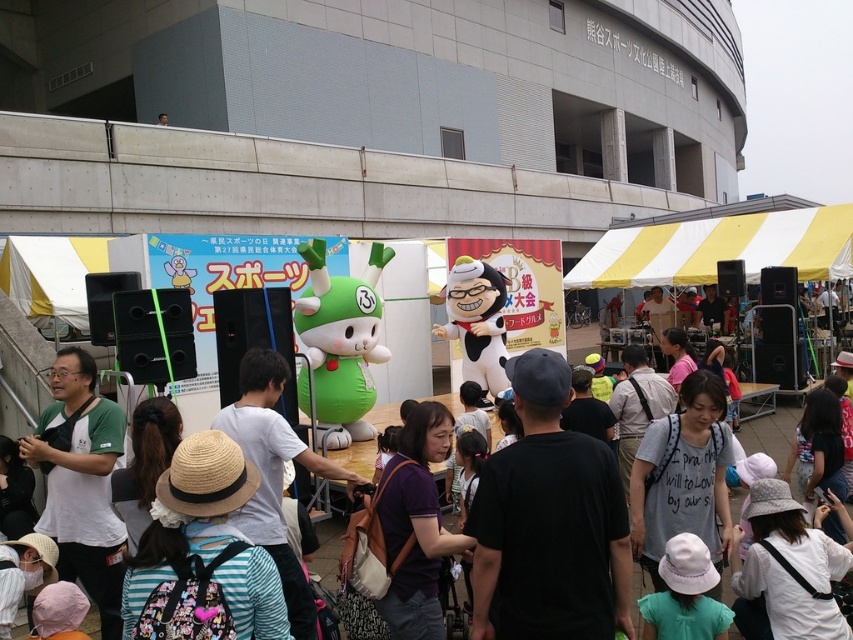
Question: Is yellow/white striped canopy at center to the left of matte green plush toy at center from the viewer's perspective?

Choices:
 (A) yes
 (B) no

Answer: (B)

Question: Which point is farther to the camera?

Choices:
 (A) black matte shirt at center
 (B) matte green plush toy at center

Answer: (B)

Question: Among these points, which one is farthest from the camera?

Choices:
 (A) (735, 236)
 (B) (741, 442)
 (C) (495, 547)

Answer: (A)

Question: Does yellow/white striped canopy at center come behind matte green plush toy at center?

Choices:
 (A) no
 (B) yes

Answer: (B)

Question: Which object is the closest to the matte green plush toy at center?

Choices:
 (A) yellow/white striped canopy at center
 (B) black matte shirt at center

Answer: (B)

Question: Does black matte shirt at center lie behind yellow/white striped canopy at center?

Choices:
 (A) yes
 (B) no

Answer: (B)